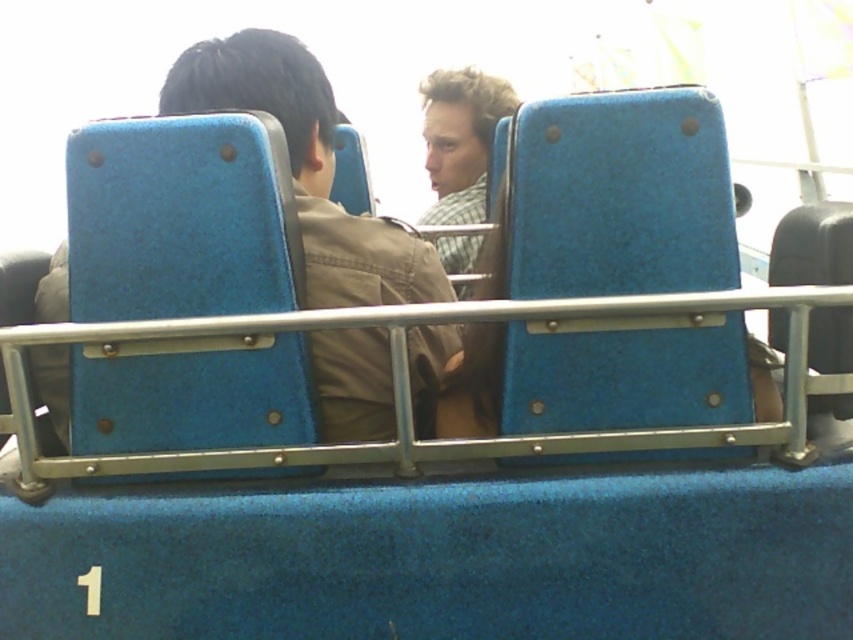
You are a photographer taking a picture of the two people sitting on the ride. You want to ensure that the matte blue jacket at center and the checkered fabric shirt at center are both visible in the frame. Based on their positions, which one should you focus on first to make sure both are in the shot?

The matte blue jacket at center is positioned on the left side of checkered fabric shirt at center, so focusing on the checkered fabric shirt at center first will ensure that both are included in the frame since the matte blue jacket at center is to the left of it.